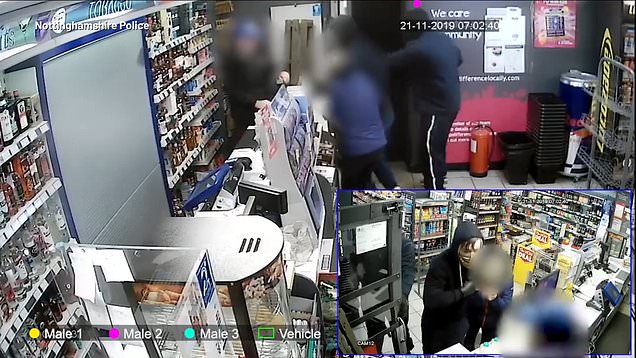
Locate an element on the screen. liquor bottles is located at coordinates (24, 174).